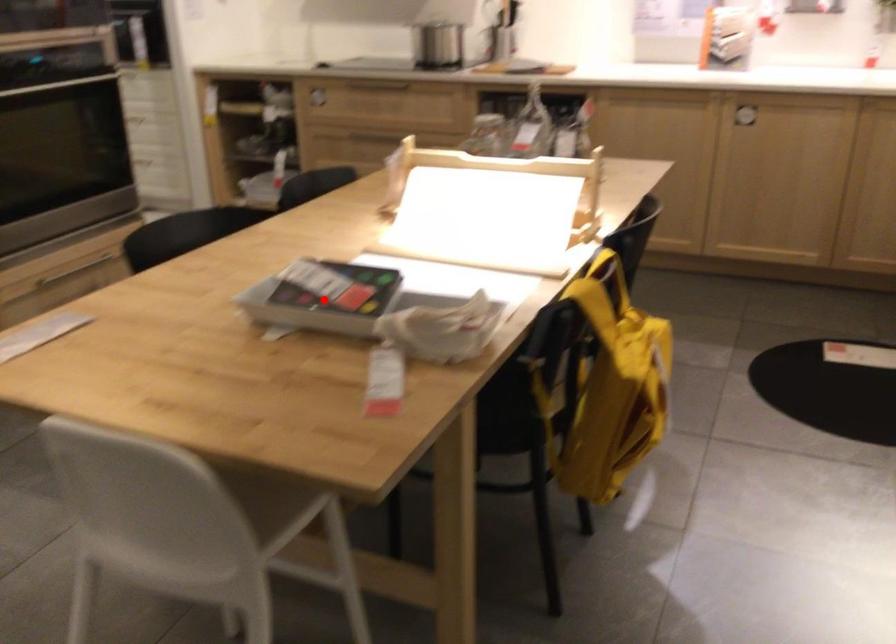
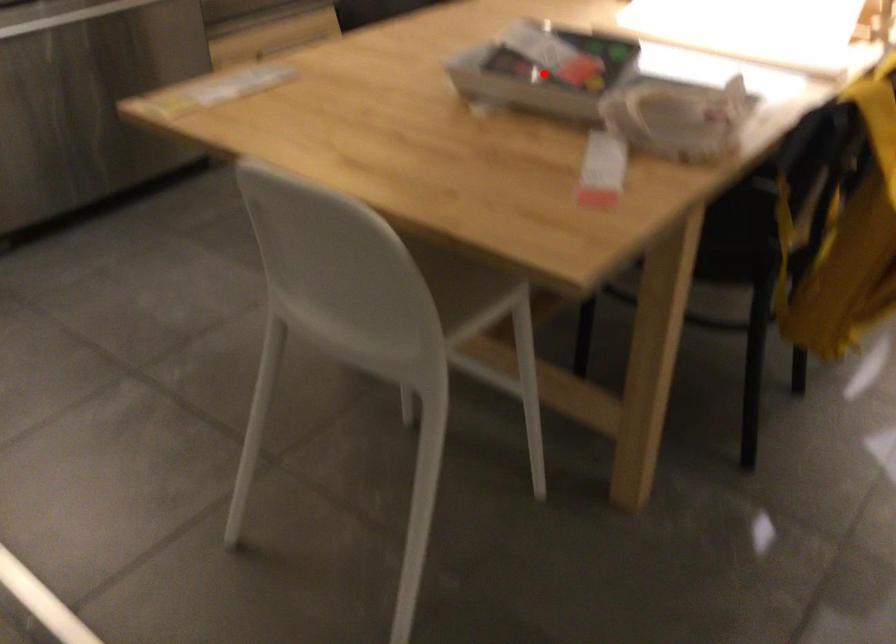
I am providing you with two images of the same scene from different viewpoints. A red point is marked on the first image and another point is marked on the second image. Is the marked point in image1 the same physical position as the marked point in image2?

Yes